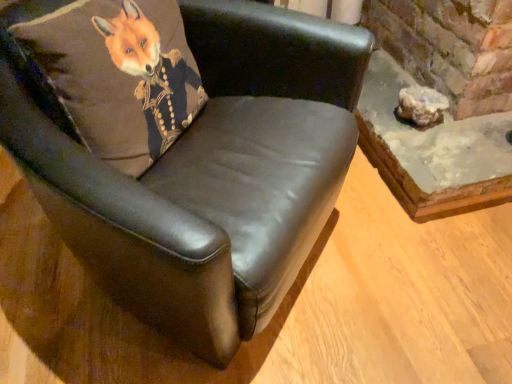
Question: From the image's perspective, is black leather chair at upper left beneath brown leather pillow at upper left?

Choices:
 (A) no
 (B) yes

Answer: (B)

Question: Can you confirm if black leather chair at upper left is thinner than brown leather pillow at upper left?

Choices:
 (A) no
 (B) yes

Answer: (A)

Question: Is black leather chair at upper left bigger than brown leather pillow at upper left?

Choices:
 (A) no
 (B) yes

Answer: (B)

Question: From a real-world perspective, is black leather chair at upper left over brown leather pillow at upper left?

Choices:
 (A) yes
 (B) no

Answer: (B)

Question: Can you confirm if black leather chair at upper left is smaller than brown leather pillow at upper left?

Choices:
 (A) no
 (B) yes

Answer: (A)

Question: Is rustic concrete table at lower right situated inside black leather chair at upper left or outside?

Choices:
 (A) inside
 (B) outside

Answer: (B)

Question: Visually, is rustic concrete table at lower right positioned to the left or to the right of black leather chair at upper left?

Choices:
 (A) right
 (B) left

Answer: (A)

Question: In terms of width, does rustic concrete table at lower right look wider or thinner when compared to black leather chair at upper left?

Choices:
 (A) thin
 (B) wide

Answer: (B)

Question: From a real-world perspective, relative to black leather chair at upper left, is rustic concrete table at lower right vertically above or below?

Choices:
 (A) below
 (B) above

Answer: (A)

Question: Is translucent white rock at lower right taller or shorter than rustic concrete table at lower right?

Choices:
 (A) tall
 (B) short

Answer: (B)

Question: Is point (409, 105) positioned closer to the camera than point (510, 122)?

Choices:
 (A) closer
 (B) farther

Answer: (A)

Question: From a real-world perspective, is translucent white rock at lower right positioned above or below rustic concrete table at lower right?

Choices:
 (A) above
 (B) below

Answer: (A)

Question: Visually, is translucent white rock at lower right positioned to the left or to the right of rustic concrete table at lower right?

Choices:
 (A) right
 (B) left

Answer: (B)

Question: From a real-world perspective, is black leather chair at upper left physically located above or below translucent white rock at lower right?

Choices:
 (A) below
 (B) above

Answer: (B)

Question: Does point (238, 157) appear closer or farther from the camera than point (436, 120)?

Choices:
 (A) closer
 (B) farther

Answer: (A)